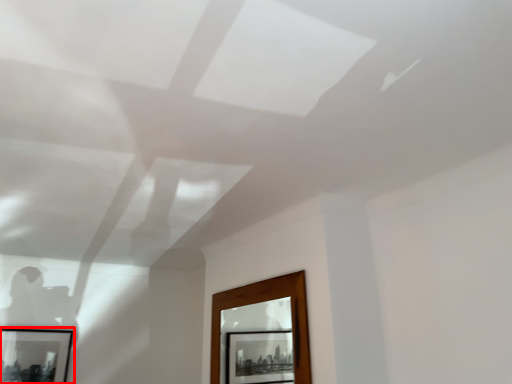
Question: Where is picture frame (annotated by the red box) located in relation to window in the image?

Choices:
 (A) right
 (B) left

Answer: (B)